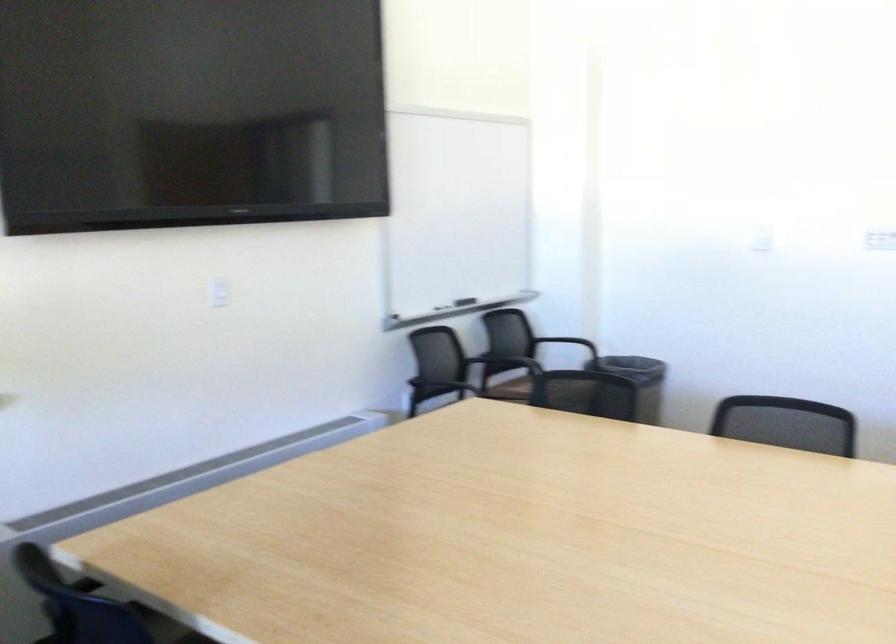
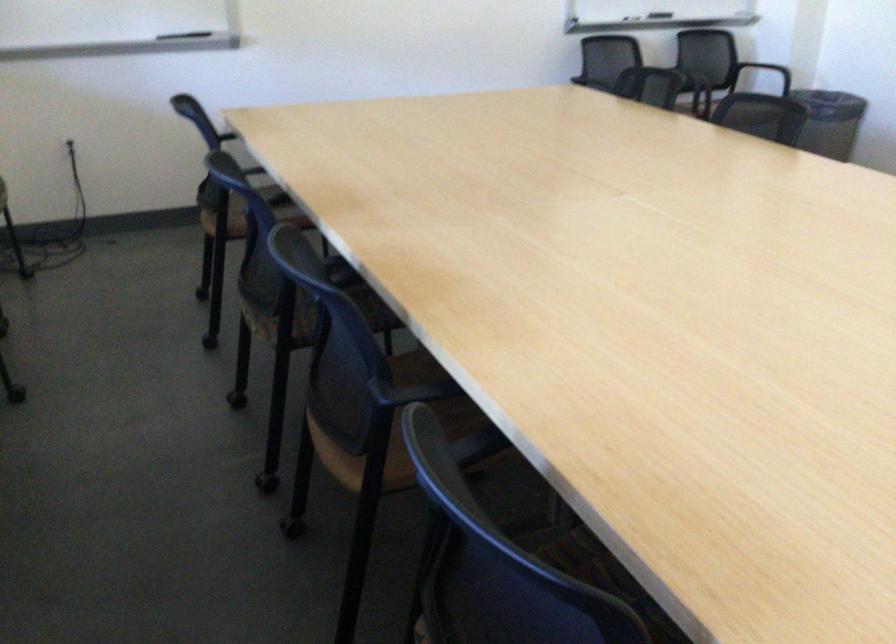
The point at (653, 390) is marked in the first image. Where is the corresponding point in the second image?

(830, 122)